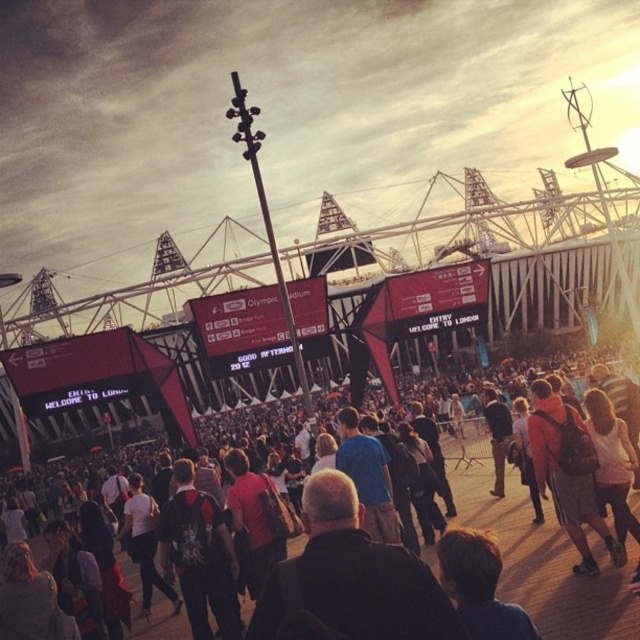
Question: In this image, where is matte black crowd at center located relative to matte black backpack at center?

Choices:
 (A) left
 (B) right

Answer: (A)

Question: From the image, what is the correct spatial relationship of dark gray backpack at center in relation to matte black backpack at center?

Choices:
 (A) left
 (B) right

Answer: (A)

Question: Can you confirm if matte black crowd at center is bigger than matte black backpack at center?

Choices:
 (A) yes
 (B) no

Answer: (A)

Question: Which of the following is the closest to the observer?

Choices:
 (A) matte black crowd at center
 (B) dark gray backpack at center

Answer: (A)

Question: Which point appears farthest from the camera in this image?

Choices:
 (A) (212, 545)
 (B) (563, 502)
 (C) (509, 554)

Answer: (B)

Question: Which object appears farthest from the camera in this image?

Choices:
 (A) matte black backpack at center
 (B) dark gray backpack at center
 (C) matte black crowd at center

Answer: (A)